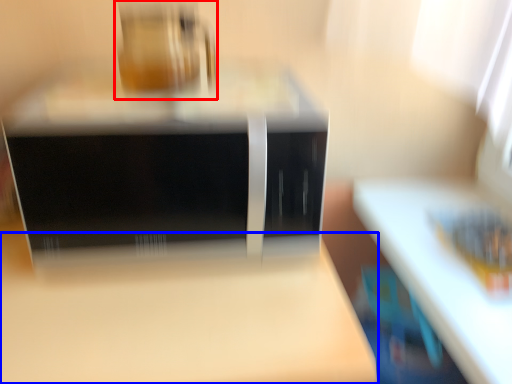
Question: Which object appears closest to the camera in this image, appliance (highlighted by a red box) or table (highlighted by a blue box)?

Choices:
 (A) appliance
 (B) table

Answer: (B)